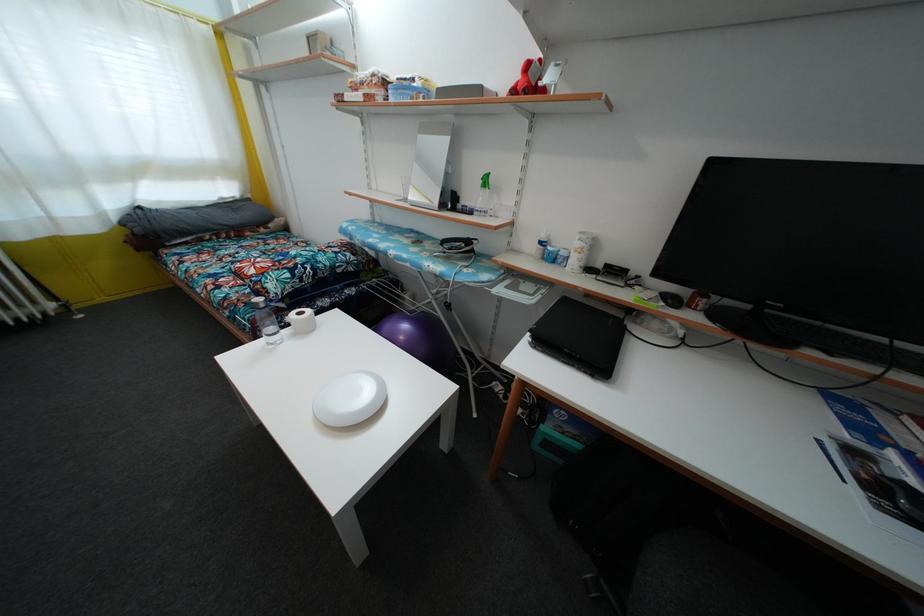
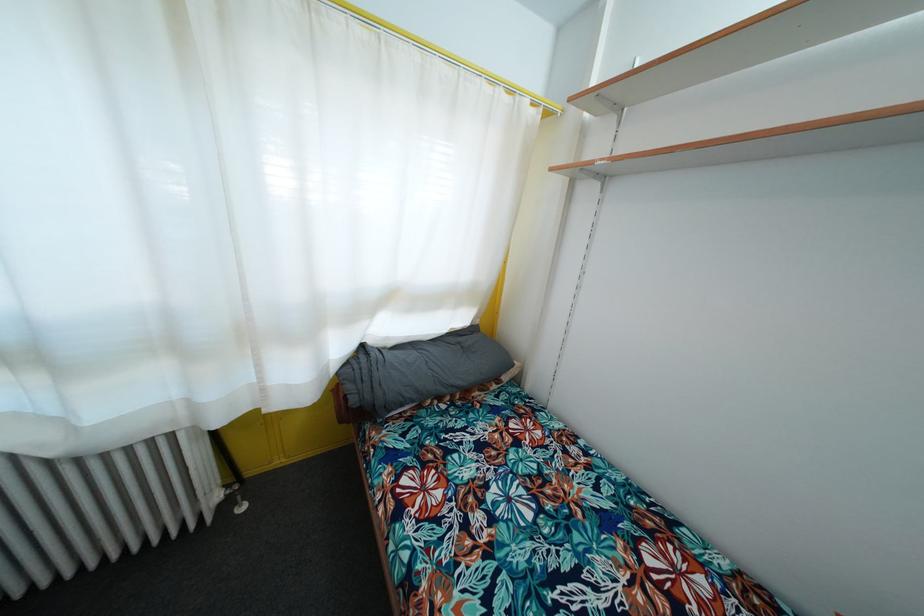
Locate, in the second image, the point that corresponds to [141,237] in the first image.

(358, 407)